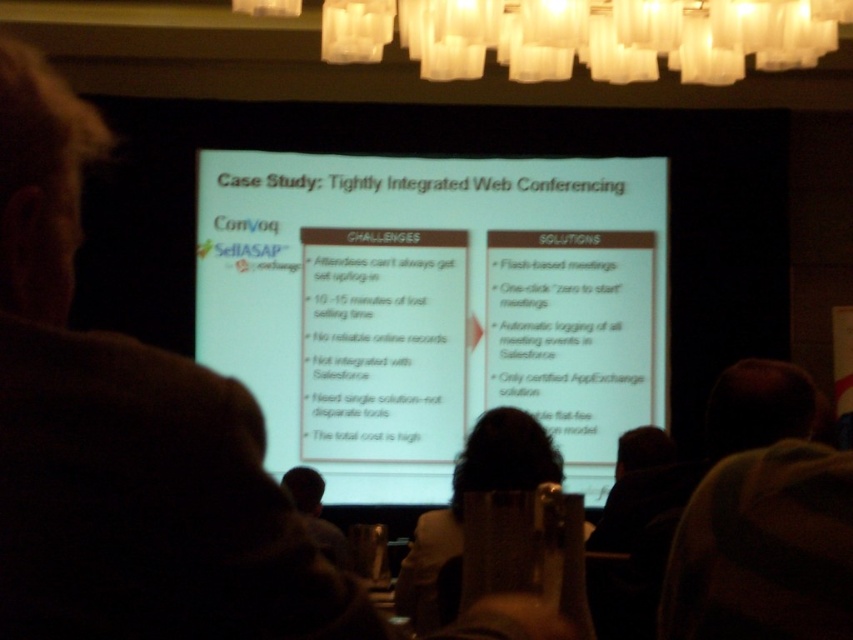
You are a presenter standing in front of the screen and want to point out the dark hair at upper left. Where should you aim your laser pointer?

The dark hair at upper left is located at point 0.691 on the x axis and 0.149 on the y axis.

What is the relationship between the width of the brown hair at upper center and the white glass chandelier at upper center?

The brown hair at upper center has a lesser width compared to the white glass chandelier at upper center.